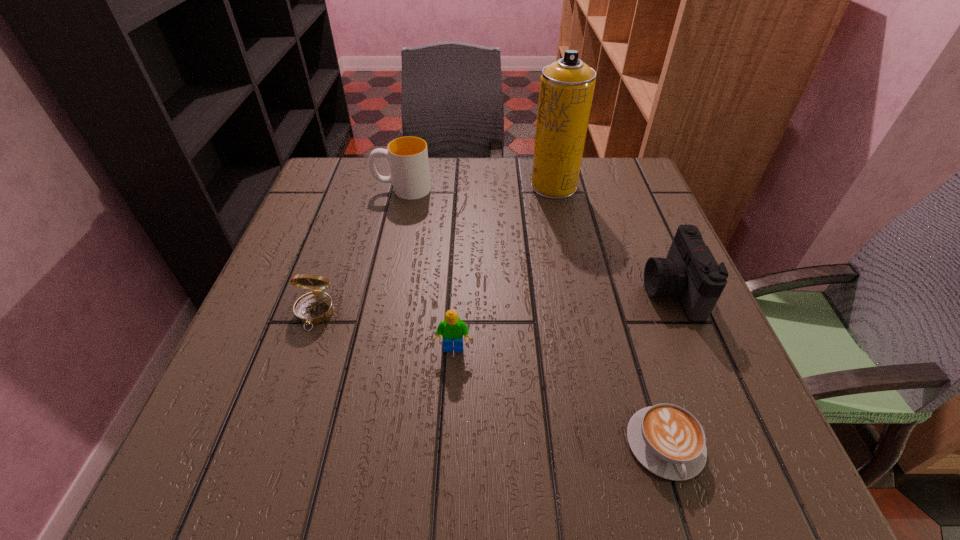
This screenshot has width=960, height=540. I want to click on free area in between the shortest object and the tallest object, so click(x=610, y=315).

The image size is (960, 540). I want to click on unoccupied area between the tallest object and the compass, so pos(434,249).

Locate an element on the screen. object that stands as the third closest to the camera is located at coordinates (452, 329).

Locate which object is the fourth closest to the camera. Please provide its 2D coordinates. Your answer should be formatted as a tuple, i.e. [(x, y)], where the tuple contains the x and y coordinates of a point satisfying the conditions above.

[(408, 156)]

Identify the location of free space that satisfies the following two spatial constraints: 1. at the lens of the camera; 2. on the face of the Lego. (696, 349).

Identify the location of free space that satisfies the following two spatial constraints: 1. with the handle on the side of the tallest object; 2. on the right side of the fifth object from right to left. Image resolution: width=960 pixels, height=540 pixels. (403, 186).